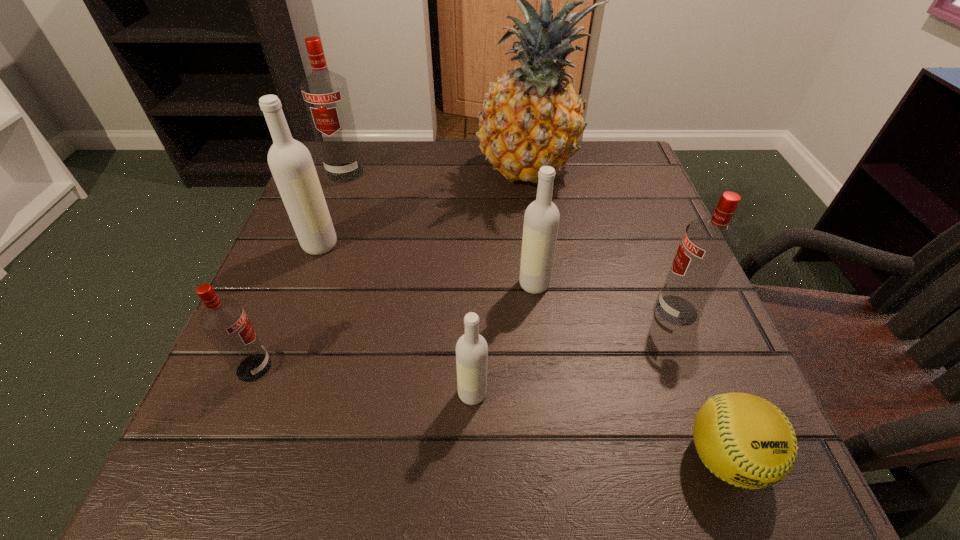
The height and width of the screenshot is (540, 960). I want to click on the third closest vodka to the second smallest white vodka, so click(x=291, y=164).

Point out which vodka is positioned as the fourth nearest to the nearest red vodka. Please provide its 2D coordinates. Your answer should be formatted as a tuple, i.e. [(x, y)], where the tuple contains the x and y coordinates of a point satisfying the conditions above.

[(325, 93)]

Identify which white vodka is the third closest to the rightmost red vodka. Please provide its 2D coordinates. Your answer should be formatted as a tuple, i.e. [(x, y)], where the tuple contains the x and y coordinates of a point satisfying the conditions above.

[(291, 164)]

This screenshot has width=960, height=540. Find the location of `white vodka that can be found as the third closest to the second biggest red vodka`. white vodka that can be found as the third closest to the second biggest red vodka is located at coordinates (291, 164).

Select which red vodka is the third closest to the leftmost white vodka. Please provide its 2D coordinates. Your answer should be formatted as a tuple, i.e. [(x, y)], where the tuple contains the x and y coordinates of a point satisfying the conditions above.

[(708, 245)]

Where is `red vodka that is the second closest to the second biggest red vodka`? red vodka that is the second closest to the second biggest red vodka is located at coordinates (325, 93).

I want to click on free point that satisfies the following two spatial constraints: 1. on the back side of the third vodka from right to left; 2. on the front label of the smallest red vodka, so click(x=473, y=368).

Locate an element on the screen. The height and width of the screenshot is (540, 960). free spot that satisfies the following two spatial constraints: 1. on the back side of the rightmost white vodka; 2. on the left side of the pineapple is located at coordinates (520, 170).

Image resolution: width=960 pixels, height=540 pixels. I want to click on free point that satisfies the following two spatial constraints: 1. on the front label of the farthest vodka; 2. on the front label of the nearest red vodka, so [271, 368].